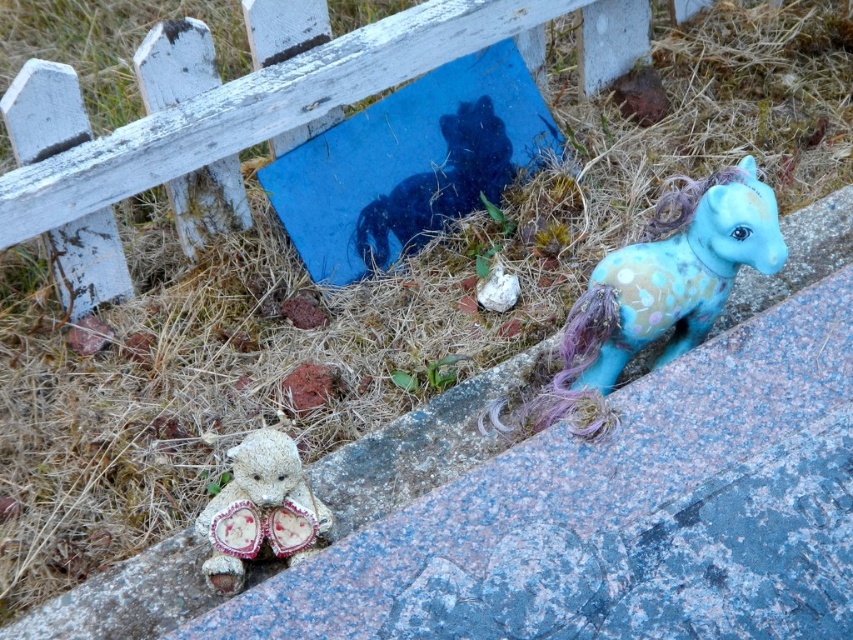
Does blue felt pony at right have a smaller size compared to blue matte horse at center?

Incorrect, blue felt pony at right is not smaller in size than blue matte horse at center.

Which is above, blue felt pony at right or blue matte horse at center?

blue matte horse at center is higher up.

Is point (640, 273) behind point (375, 257)?

No, it is in front of (375, 257).

Identify the location of blue felt pony at right. (654, 292).

Is white wooden fence at upper left wider than fuzzy fabric teddy bear at lower left?

Yes, white wooden fence at upper left is wider than fuzzy fabric teddy bear at lower left.

Does point (53, 104) lie behind point (234, 570)?

Yes, point (53, 104) is farther from viewer.

This screenshot has width=853, height=640. Describe the element at coordinates (245, 113) in the screenshot. I see `white wooden fence at upper left` at that location.

The image size is (853, 640). What are the coordinates of `white wooden fence at upper left` in the screenshot? It's located at (245, 113).

Which is in front, point (578, 330) or point (260, 483)?

Positioned in front is point (260, 483).

Does point (572, 316) come farther from viewer compared to point (289, 532)?

Yes, point (572, 316) is behind point (289, 532).

Is point (682, 307) farther from viewer compared to point (218, 509)?

Yes, point (682, 307) is behind point (218, 509).

The width and height of the screenshot is (853, 640). Find the location of `blue felt pony at right`. blue felt pony at right is located at coordinates (654, 292).